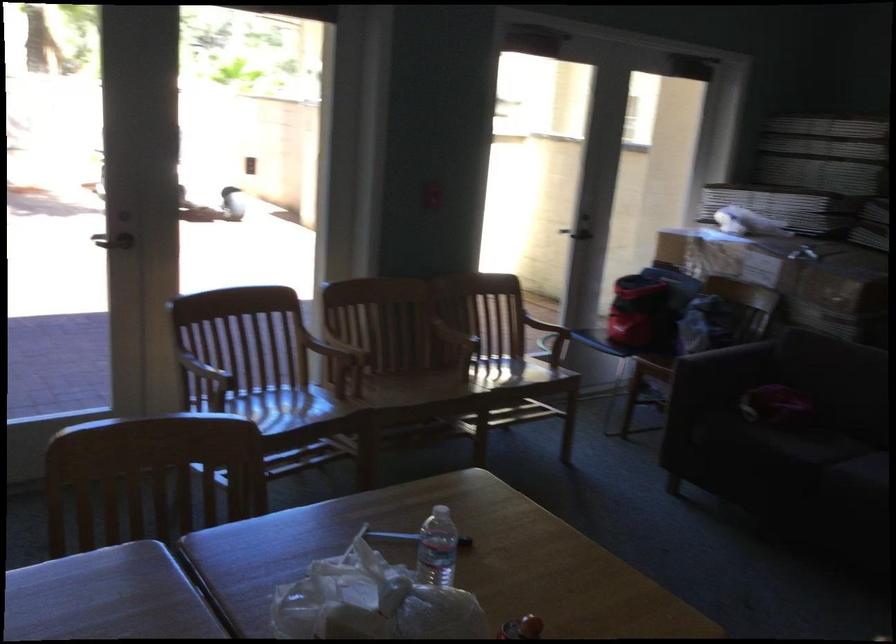
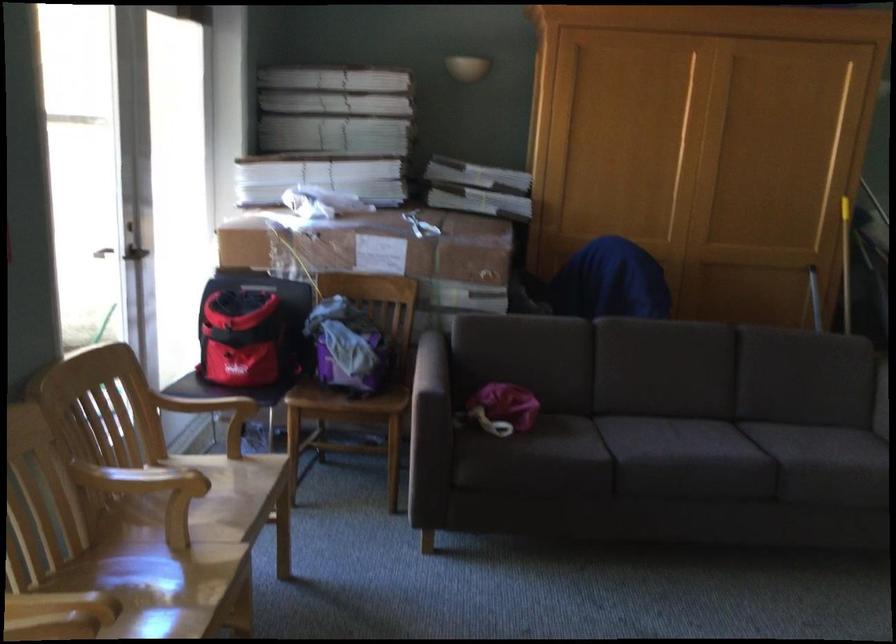
Find the pixel in the second image that matches point 641,314 in the first image.

(271, 360)